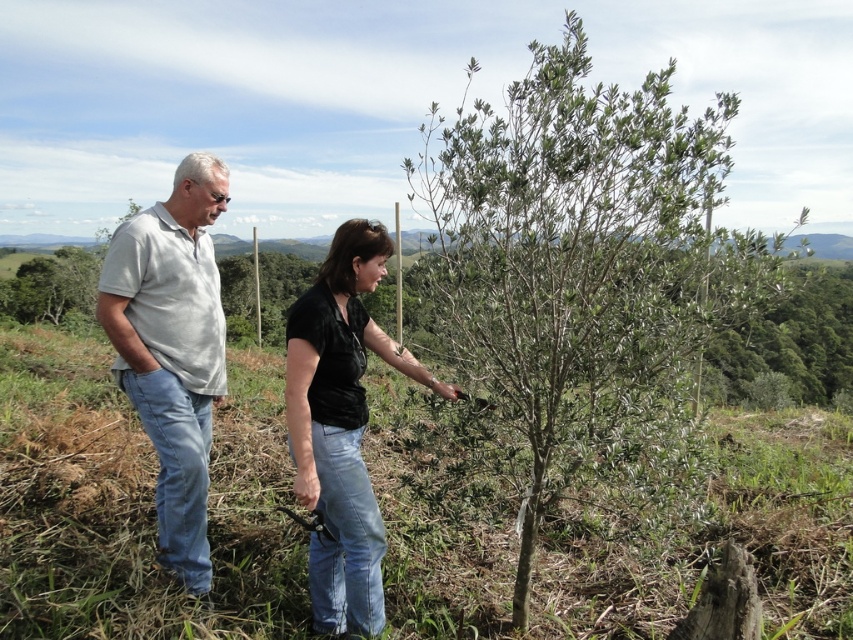
You are a photographer standing 10 feet away from the gray cotton shirt at left and the black matte shirt at center. You want to take a photo of both people in the same frame without moving them. Given that your camera has a maximum zoom of 5x, can you fit both individuals into the frame?

The gray cotton shirt at left and black matte shirt at center are 28.44 inches apart. At 10 feet away with a 5x zoom, the camera can capture a field of view wide enough to include both subjects since 28.44 inches is within the camera range.

You are a landscape designer assessing the space between the green leafy shrub at center and the gray cotton shirt at left. Can you determine if the shrub is wider than the shirt?

The green leafy shrub at center might be wider than gray cotton shirt at left according to the description provided.

You are a gardener who needs to water the green leafy shrub at center and the black matte shirt at center. Since you can only water one at a time, which one should you approach first if you are standing to the left of both objects?

You should approach the black matte shirt at center first because it is closer to your position on the left since the green leafy shrub at center is to the right of the black matte shirt at center.